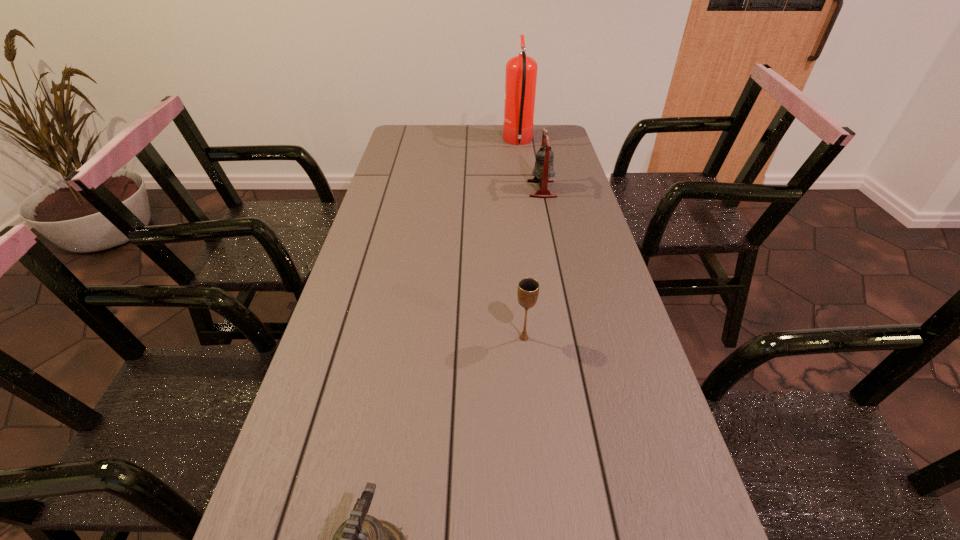
At what (x,y) coordinates should I click in order to perform the action: click on the tallest object. Please return your answer as a coordinate pair (x, y). Looking at the image, I should click on (521, 71).

Find the location of a particular element. the farthest object is located at coordinates 521,71.

Locate an element on the screen. the third nearest object is located at coordinates (x=543, y=170).

Image resolution: width=960 pixels, height=540 pixels. Find the location of `the taller bell`. the taller bell is located at coordinates (543, 170).

The height and width of the screenshot is (540, 960). What are the coordinates of `chalice` in the screenshot? It's located at (528, 288).

Image resolution: width=960 pixels, height=540 pixels. Identify the location of vacant space situated 0.350m towards the nozzle of the fire extinguisher. (420, 143).

At what (x,y) coordinates should I click in order to perform the action: click on free space located towards the nozzle of the fire extinguisher. Please return your answer as a coordinate pair (x, y). Looking at the image, I should click on (424, 143).

Where is `free space located towards the nozzle of the fire extinguisher`? free space located towards the nozzle of the fire extinguisher is located at coordinates (453, 143).

Where is `vacant space located 0.090m on the right of the right bell`? This screenshot has height=540, width=960. vacant space located 0.090m on the right of the right bell is located at coordinates (x=581, y=189).

At what (x,y) coordinates should I click in order to perform the action: click on vacant space situated on the front of the third farthest object. Please return your answer as a coordinate pair (x, y). This screenshot has width=960, height=540. Looking at the image, I should click on (541, 516).